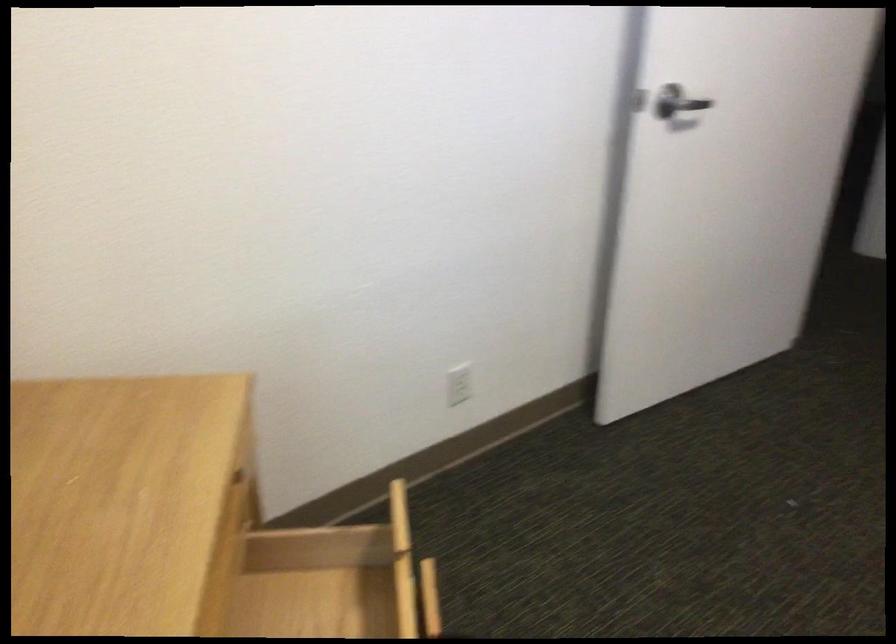
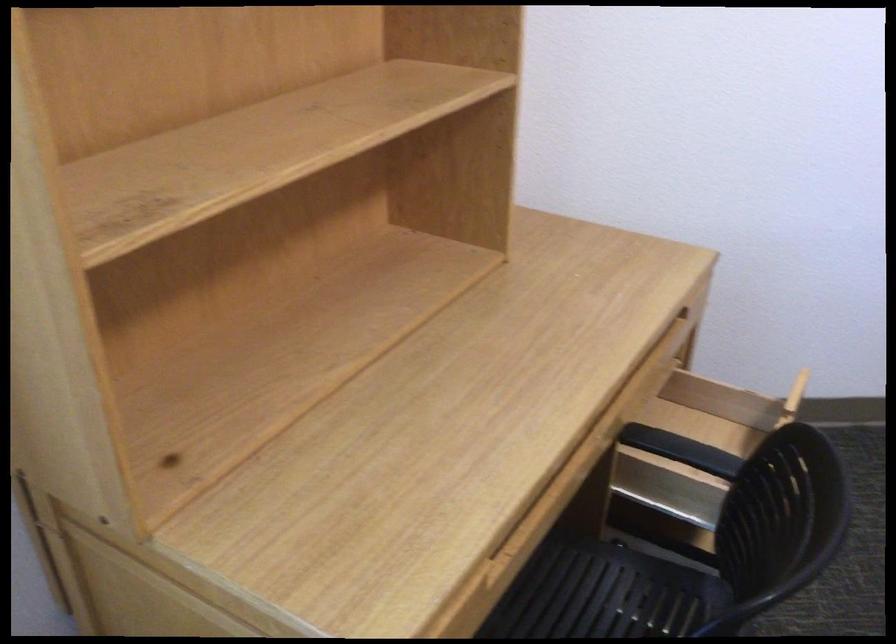
Locate, in the second image, the point that corresponds to the point at 245,462 in the first image.

(691, 313)